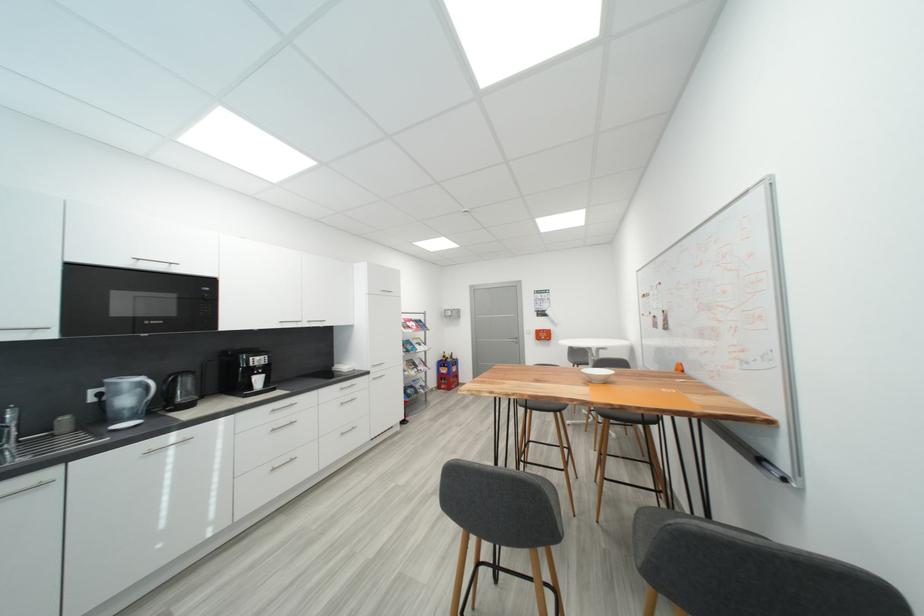
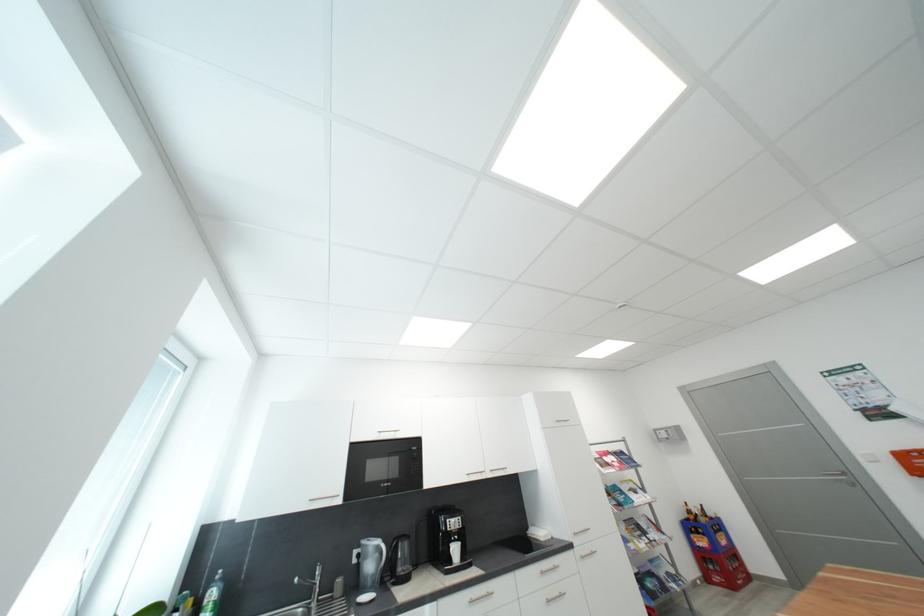
Locate, in the second image, the point that corresponds to (x=544, y=334) in the first image.

(910, 459)